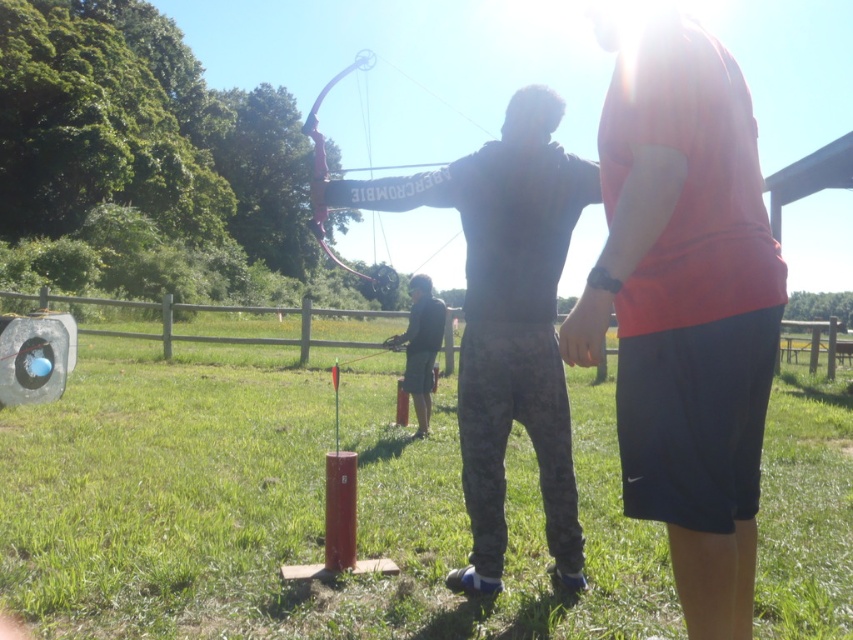
The image size is (853, 640). What do you see at coordinates (686, 308) in the screenshot? I see `orange fabric shirt at upper right` at bounding box center [686, 308].

Between point (695, 106) and point (428, 396), which one is positioned behind?

The point (428, 396) is more distant.

Find the location of a particular element. Image resolution: width=853 pixels, height=640 pixels. orange fabric shirt at upper right is located at coordinates (686, 308).

The height and width of the screenshot is (640, 853). Identify the location of orange fabric shirt at upper right. (686, 308).

Who is lower down, matte black hoodie at center or pink matte bow at center?

Positioned lower is matte black hoodie at center.

Does matte black hoodie at center come in front of pink matte bow at center?

Yes, it is.

Locate an element on the screen. matte black hoodie at center is located at coordinates (503, 316).

The image size is (853, 640). What are the coordinates of `matte black hoodie at center` in the screenshot? It's located at (503, 316).

Is orange fabric shirt at upper right closer to the viewer compared to pink matte bow at center?

Yes, orange fabric shirt at upper right is closer to the viewer.

Can you confirm if orange fabric shirt at upper right is smaller than pink matte bow at center?

Indeed, orange fabric shirt at upper right has a smaller size compared to pink matte bow at center.

Find the location of a particular element. This screenshot has width=853, height=640. orange fabric shirt at upper right is located at coordinates (686, 308).

At what (x,y) coordinates should I click in order to perform the action: click on orange fabric shirt at upper right. Please return your answer as a coordinate pair (x, y). This screenshot has width=853, height=640. Looking at the image, I should click on (686, 308).